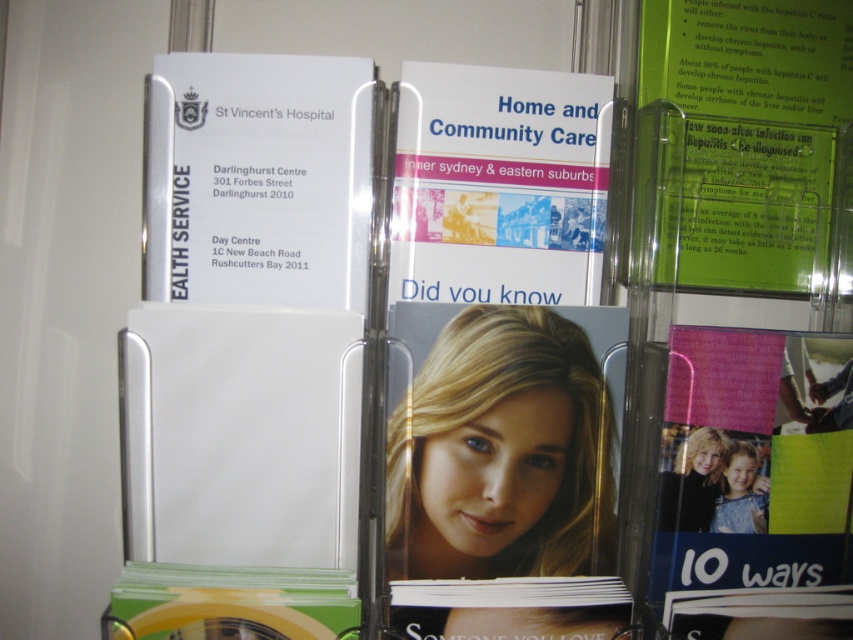
Question: Is pink glossy magazine at lower right positioned at the back of white paper at center?

Choices:
 (A) no
 (B) yes

Answer: (A)

Question: Can you confirm if green plastic card at upper right is positioned to the right of green glossy magazine at lower left?

Choices:
 (A) no
 (B) yes

Answer: (B)

Question: Which point is closer to the camera taking this photo?

Choices:
 (A) (163, 212)
 (B) (350, 612)
 (C) (706, 502)
 (D) (798, 234)

Answer: (B)

Question: Does green plastic card at upper right have a smaller size compared to green glossy magazine at lower left?

Choices:
 (A) no
 (B) yes

Answer: (A)

Question: Which point is farther to the camera?

Choices:
 (A) green plastic card at upper right
 (B) green glossy magazine at lower left
 (C) white paper at upper left
 (D) white paper at center

Answer: (A)

Question: Among these objects, which one is nearest to the camera?

Choices:
 (A) green plastic card at upper right
 (B) pink glossy magazine at lower right

Answer: (B)